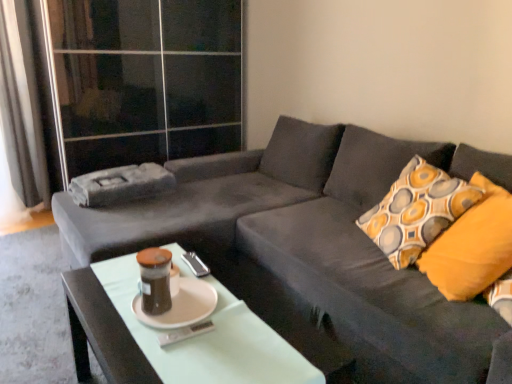
Question: Is teal glass jar at center a part of patterned fabric pillow at right?

Choices:
 (A) yes
 (B) no

Answer: (B)

Question: From a real-world perspective, does patterned fabric pillow at right stand above teal glass jar at center?

Choices:
 (A) no
 (B) yes

Answer: (B)

Question: Is patterned fabric pillow at right far from teal glass jar at center?

Choices:
 (A) no
 (B) yes

Answer: (B)

Question: Can you confirm if patterned fabric pillow at right is bigger than teal glass jar at center?

Choices:
 (A) no
 (B) yes

Answer: (B)

Question: Is patterned fabric pillow at right oriented away from teal glass jar at center?

Choices:
 (A) no
 (B) yes

Answer: (A)

Question: Is patterned fabric pillow at right wider than teal glass jar at center?

Choices:
 (A) no
 (B) yes

Answer: (B)

Question: Considering the relative sizes of white matte saucer at center and patterned fabric pillow at right in the image provided, is white matte saucer at center shorter than patterned fabric pillow at right?

Choices:
 (A) no
 (B) yes

Answer: (B)

Question: Is white matte saucer at center not inside patterned fabric pillow at right?

Choices:
 (A) yes
 (B) no

Answer: (A)

Question: Does white matte saucer at center have a greater width compared to patterned fabric pillow at right?

Choices:
 (A) no
 (B) yes

Answer: (A)

Question: Is white matte saucer at center turned away from patterned fabric pillow at right?

Choices:
 (A) no
 (B) yes

Answer: (A)

Question: Does white matte saucer at center appear on the right side of patterned fabric pillow at right?

Choices:
 (A) yes
 (B) no

Answer: (B)

Question: Is white matte saucer at center facing towards patterned fabric pillow at right?

Choices:
 (A) yes
 (B) no

Answer: (B)

Question: Does white glossy coffee table at center have a smaller size compared to patterned fabric pillow at right?

Choices:
 (A) yes
 (B) no

Answer: (A)